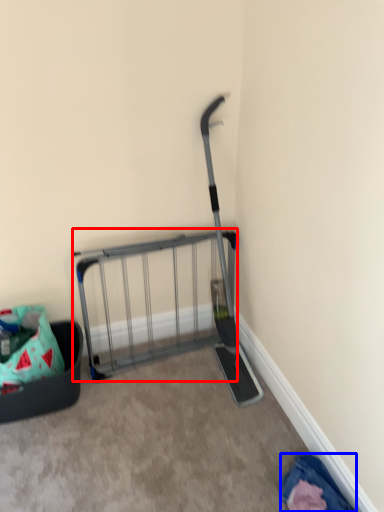
Question: Among these objects, which one is nearest to the camera, cart (highlighted by a red box) or clothing (highlighted by a blue box)?

Choices:
 (A) cart
 (B) clothing

Answer: (B)